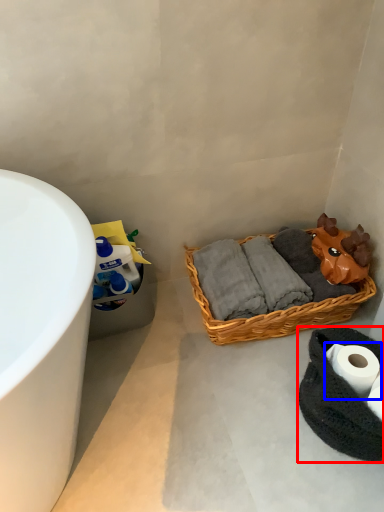
Question: Which object appears closest to the camera in this image, material (highlighted by a red box) or toilet paper (highlighted by a blue box)?

Choices:
 (A) material
 (B) toilet paper

Answer: (A)